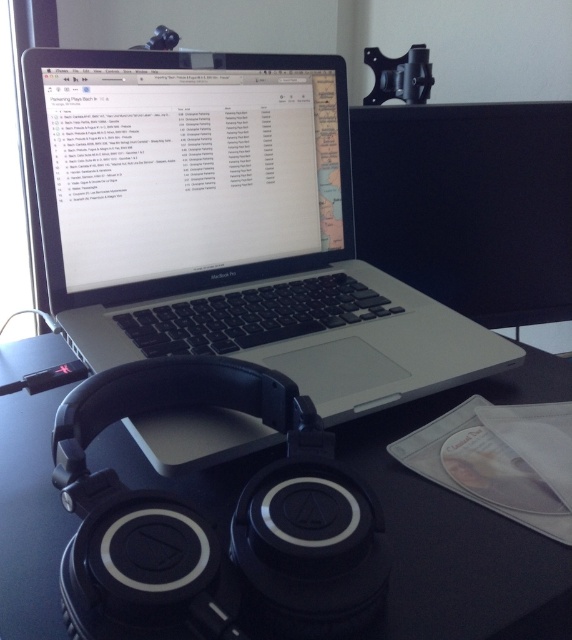
You are setting up a new monitor on your desk and need to place it in such a way that it doesn not block the view of the sleek silver laptop at center. Where should you position the monitor relative to the laptop?

The sleek silver laptop at center is located at coordinates point (227,227). To avoid blocking its view, position the monitor either to the side or behind the laptop, ensuring it doesn t obstruct the line of sight from the laptop to your primary viewing area.

You are organizing items on your desk and want to place a new pair of headphones. The existing headphones are located at point (462, 528). Where should you place the new headphones to avoid overlapping with the existing ones?

The existing black matte headphones at center are located at point (462, 528). To avoid overlapping, place the new headphones at a different coordinate such as 0.6, 0.5.

You are standing in front of the workspace and want to place a small object exactly halfway between the point at coordinates point [102,280] and the point at coordinates point [551,304]. Will the midpoint be closer to the viewer or further away compared to the original points?

The midpoint between point [102,280] and point [551,304] will be closer to the viewer than point [551,304] but further away than point [102,280]. However, since the original points are described with their coordinates, the exact spatial relationship requires calculating the midpoint coordinates. The midpoint coordinates would be at the average of the x and y values of the two points. The x coordinate is 0.439 and 0.475, so the average is 0.457. The y coordinate is 0.180 and 0.965, so the average